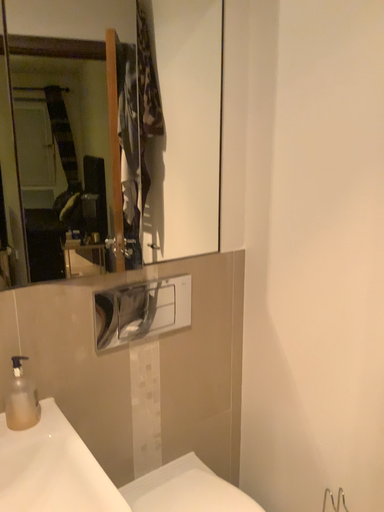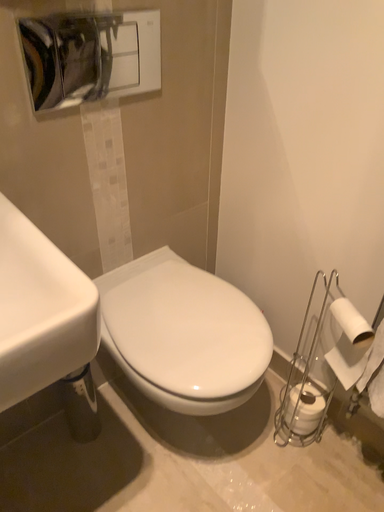
Question: How did the camera likely rotate when shooting the video?

Choices:
 (A) rotated downward
 (B) rotated upward

Answer: (A)